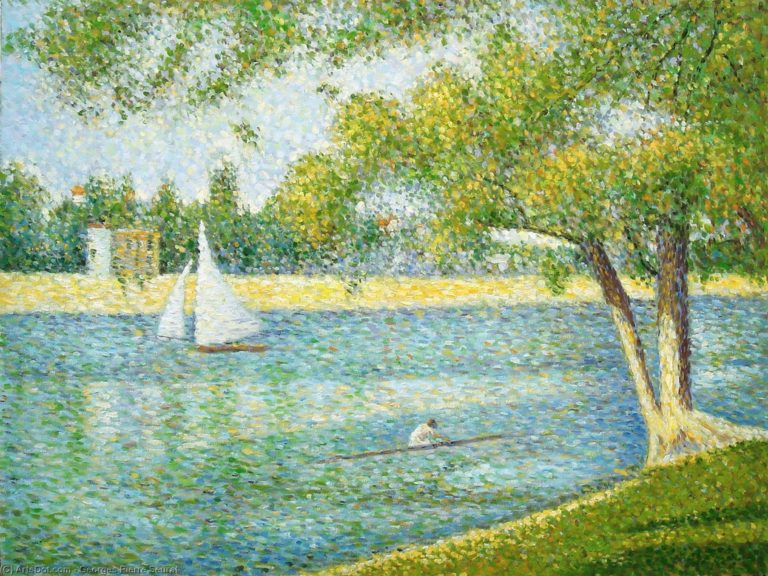
At what (x,y) coordinates should I click in order to perform the action: click on painting. Please return your answer as a coordinate pair (x, y). The image size is (768, 576). Looking at the image, I should click on (445, 352).